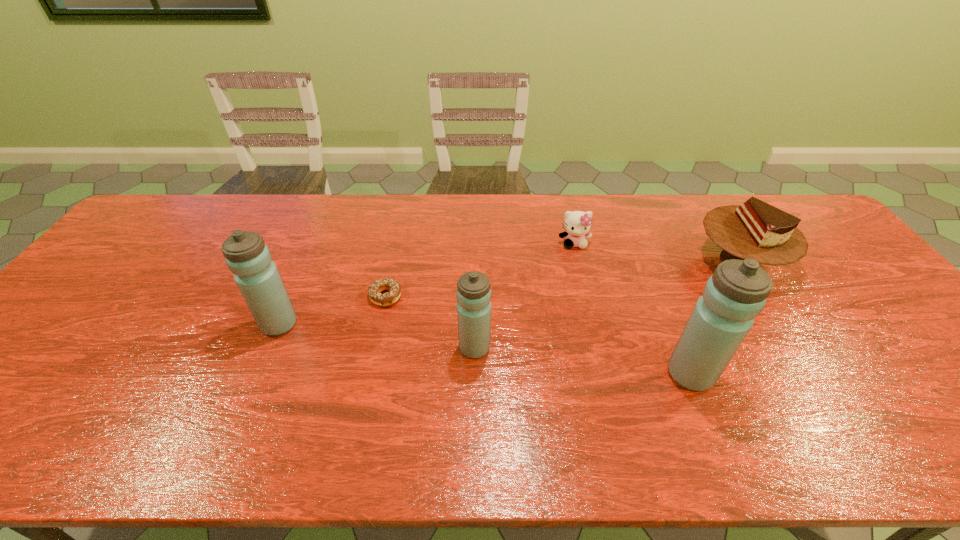
The height and width of the screenshot is (540, 960). Identify the location of free space that is in between the fifth object from right to left and the third shortest object. (563, 278).

Locate an element on the screen. This screenshot has height=540, width=960. vacant region between the fourth object from left to right and the shortest object is located at coordinates (480, 269).

Image resolution: width=960 pixels, height=540 pixels. Identify the location of free spot between the rightmost water bottle and the second water bottle from right to left. (583, 361).

Where is `vacant space that's between the second object from left to right and the leftmost object`? vacant space that's between the second object from left to right and the leftmost object is located at coordinates click(x=332, y=310).

Find the location of a particular element. This screenshot has width=960, height=540. the third closest object to the rightmost water bottle is located at coordinates (473, 292).

Select which object appears as the third closest to the shortest water bottle. Please provide its 2D coordinates. Your answer should be formatted as a tuple, i.e. [(x, y)], where the tuple contains the x and y coordinates of a point satisfying the conditions above.

[(736, 293)]

Identify which water bottle is located as the nearest to the second object from right to left. Please provide its 2D coordinates. Your answer should be formatted as a tuple, i.e. [(x, y)], where the tuple contains the x and y coordinates of a point satisfying the conditions above.

[(473, 292)]

Select which water bottle appears as the closest to the cake. Please provide its 2D coordinates. Your answer should be formatted as a tuple, i.e. [(x, y)], where the tuple contains the x and y coordinates of a point satisfying the conditions above.

[(736, 293)]

Find the location of `blank space that satisfies the following two spatial constraints: 1. on the front-facing side of the fourth object from left to right; 2. on the left side of the fourth tallest object`. blank space that satisfies the following two spatial constraints: 1. on the front-facing side of the fourth object from left to right; 2. on the left side of the fourth tallest object is located at coordinates (578, 260).

The height and width of the screenshot is (540, 960). I want to click on vacant space that satisfies the following two spatial constraints: 1. on the front-facing side of the fourth tallest object; 2. on the left side of the third object from right to left, so click(x=578, y=260).